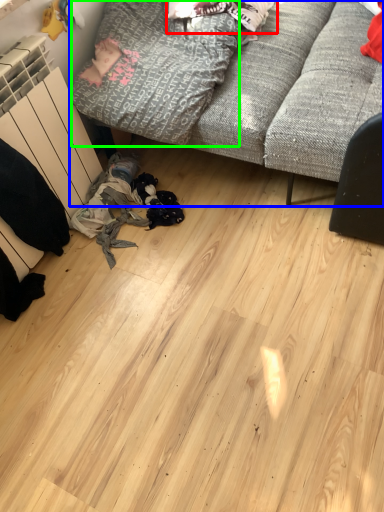
Question: Which is nearer to the clothing (highlighted by a red box)? studio couch (highlighted by a blue box) or clothing (highlighted by a green box).

Choices:
 (A) studio couch
 (B) clothing

Answer: (B)